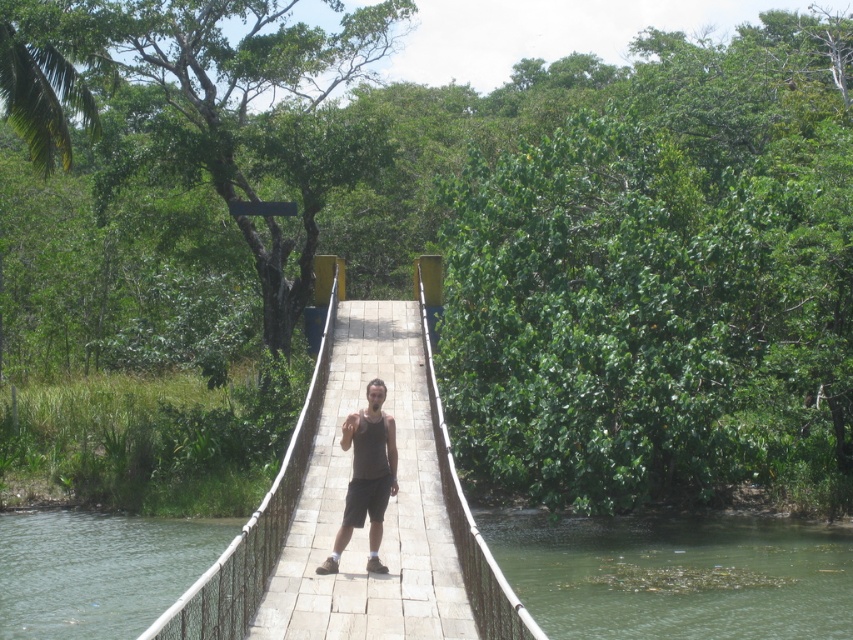
Question: Is green water at lower left positioned in front of dark gray tank top at center?

Choices:
 (A) no
 (B) yes

Answer: (A)

Question: Which is farther from the green water at lower left?

Choices:
 (A) green murky water at center
 (B) dark gray tank top at center
 (C) green murky water at lower center

Answer: (B)

Question: Can you confirm if wooden bridge at center is wider than dark gray tank top at center?

Choices:
 (A) no
 (B) yes

Answer: (B)

Question: Is green murky water at center to the left of wooden bridge at center from the viewer's perspective?

Choices:
 (A) yes
 (B) no

Answer: (A)

Question: Which point is closer to the camera?

Choices:
 (A) green murky water at center
 (B) green murky water at lower center
 (C) dark gray tank top at center

Answer: (C)

Question: Which of the following is the closest to the observer?

Choices:
 (A) wooden bridge at center
 (B) dark gray tank top at center
 (C) green murky water at lower center
 (D) green water at lower left

Answer: (A)